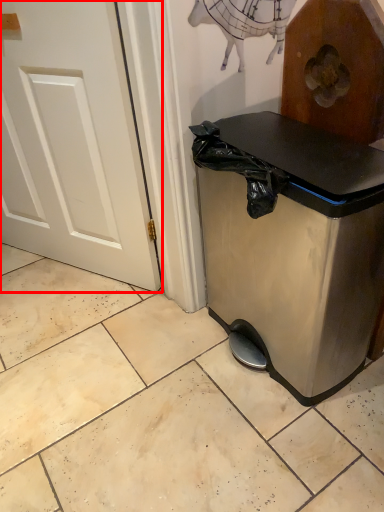
Question: From the image, what is the correct spatial relationship of door (annotated by the red box) in relation to waste container?

Choices:
 (A) right
 (B) left

Answer: (B)